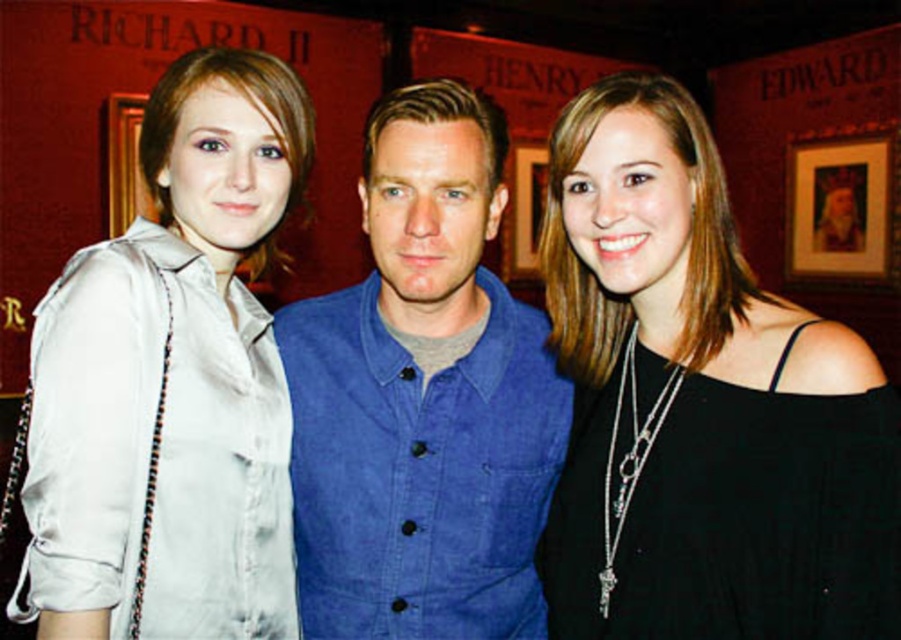
Can you confirm if black matte dress at center is taller than denim vest at center?

Incorrect, black matte dress at center's height is not larger of denim vest at center's.

Does black matte dress at center appear under denim vest at center?

Incorrect, black matte dress at center is not positioned below denim vest at center.

Between point (640, 186) and point (485, 301), which one is positioned in front?

Point (640, 186)

You are a GUI agent. You are given a task and a screenshot of the screen. Output one action in this format:
    pyautogui.click(x=<x>, y=<y>)
    Task: Click on the black matte dress at center
    This screenshot has width=901, height=640.
    Given the screenshot: What is the action you would take?
    pyautogui.click(x=701, y=404)

Which is behind, point (84, 392) or point (430, 524)?

The point (430, 524) is behind.

Does silky beige blouse at left have a lesser height compared to denim vest at center?

No.

Is point (247, 221) in front of point (388, 540)?

That is True.

This screenshot has width=901, height=640. Find the location of `silky beige blouse at left`. silky beige blouse at left is located at coordinates (171, 381).

Does black matte dress at center lie behind silky beige blouse at left?

No, it is in front of silky beige blouse at left.

Where is `black matte dress at center`? This screenshot has width=901, height=640. black matte dress at center is located at coordinates (701, 404).

Identify the location of black matte dress at center. (701, 404).